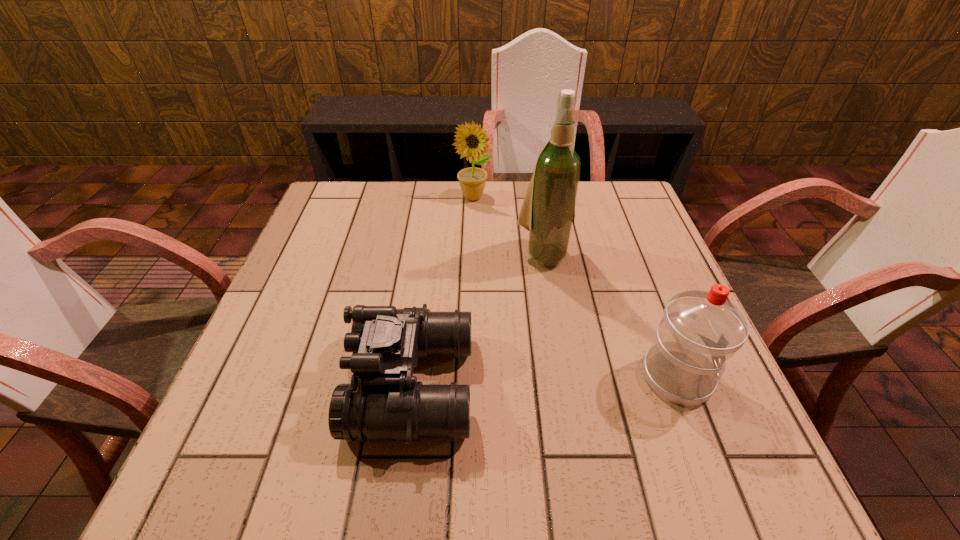
At what (x,y) coordinates should I click in order to perform the action: click on free spot between the farthest object and the rightmost object. Please return your answer as a coordinate pair (x, y). Looking at the image, I should click on (575, 287).

Locate an element on the screen. This screenshot has width=960, height=540. empty location between the second farthest object and the farthest object is located at coordinates (508, 226).

In order to click on vacant space in between the rightmost object and the farthest object in this screenshot , I will do `click(575, 287)`.

Locate an element on the screen. The height and width of the screenshot is (540, 960). unoccupied area between the tallest object and the water bottle is located at coordinates (611, 315).

Where is `free point between the binoculars and the sunflower`? The image size is (960, 540). free point between the binoculars and the sunflower is located at coordinates (443, 291).

I want to click on free spot between the sunflower and the third nearest object, so click(508, 226).

The width and height of the screenshot is (960, 540). Identify the location of vacant space that is in between the farthest object and the binoculars. (x=443, y=291).

Identify the location of the third closest object to the farthest object. The image size is (960, 540). (700, 330).

Select which object appears as the closest to the wine bottle. Please provide its 2D coordinates. Your answer should be formatted as a tuple, i.e. [(x, y)], where the tuple contains the x and y coordinates of a point satisfying the conditions above.

[(471, 140)]

Find the location of a particular element. free space that satisfies the following two spatial constraints: 1. on the front side of the rightmost object; 2. on the handle side of the farthest object is located at coordinates (468, 377).